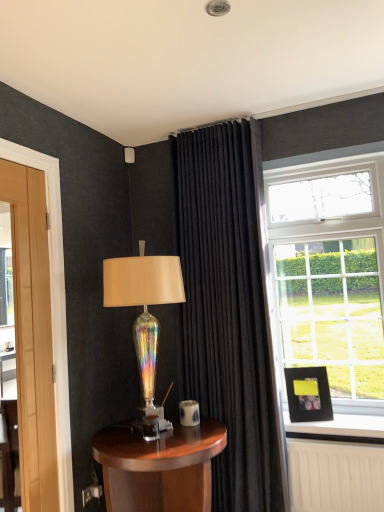
Question: Considering the relative positions of black velvet curtain at center and iridescent glass lamp at center in the image provided, is black velvet curtain at center behind iridescent glass lamp at center?

Choices:
 (A) yes
 (B) no

Answer: (A)

Question: Does black velvet curtain at center have a smaller size compared to iridescent glass lamp at center?

Choices:
 (A) no
 (B) yes

Answer: (A)

Question: Is black velvet curtain at center wider than iridescent glass lamp at center?

Choices:
 (A) yes
 (B) no

Answer: (B)

Question: Can you confirm if black velvet curtain at center is positioned to the right of iridescent glass lamp at center?

Choices:
 (A) no
 (B) yes

Answer: (B)

Question: From a real-world perspective, is black velvet curtain at center positioned over iridescent glass lamp at center based on gravity?

Choices:
 (A) no
 (B) yes

Answer: (B)

Question: Considering the relative positions of iridescent glass lamp at center and wooden table at lower center in the image provided, is iridescent glass lamp at center to the left or to the right of wooden table at lower center?

Choices:
 (A) right
 (B) left

Answer: (B)

Question: Do you think iridescent glass lamp at center is within wooden table at lower center, or outside of it?

Choices:
 (A) outside
 (B) inside

Answer: (A)

Question: In terms of width, does iridescent glass lamp at center look wider or thinner when compared to wooden table at lower center?

Choices:
 (A) thin
 (B) wide

Answer: (A)

Question: In terms of size, does iridescent glass lamp at center appear bigger or smaller than wooden table at lower center?

Choices:
 (A) small
 (B) big

Answer: (A)

Question: Visually, is black velvet curtain at center positioned to the left or to the right of iridescent glass lamp at center?

Choices:
 (A) right
 (B) left

Answer: (A)

Question: Considering the positions of point (210, 287) and point (173, 286), is point (210, 287) closer or farther from the camera than point (173, 286)?

Choices:
 (A) farther
 (B) closer

Answer: (A)

Question: From a real-world perspective, is black velvet curtain at center positioned above or below iridescent glass lamp at center?

Choices:
 (A) above
 (B) below

Answer: (A)

Question: In terms of width, does black velvet curtain at center look wider or thinner when compared to iridescent glass lamp at center?

Choices:
 (A) thin
 (B) wide

Answer: (A)

Question: Would you say black matte picture frame at right is to the left or to the right of wooden table at lower center in the picture?

Choices:
 (A) right
 (B) left

Answer: (A)

Question: Is point (329, 411) positioned closer to the camera than point (92, 452)?

Choices:
 (A) farther
 (B) closer

Answer: (A)